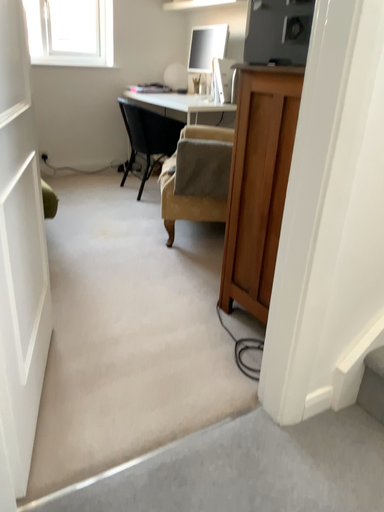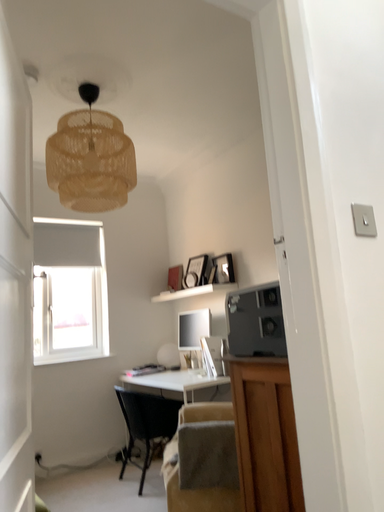
Question: Which way did the camera rotate in the video?

Choices:
 (A) rotated upward
 (B) rotated downward

Answer: (A)